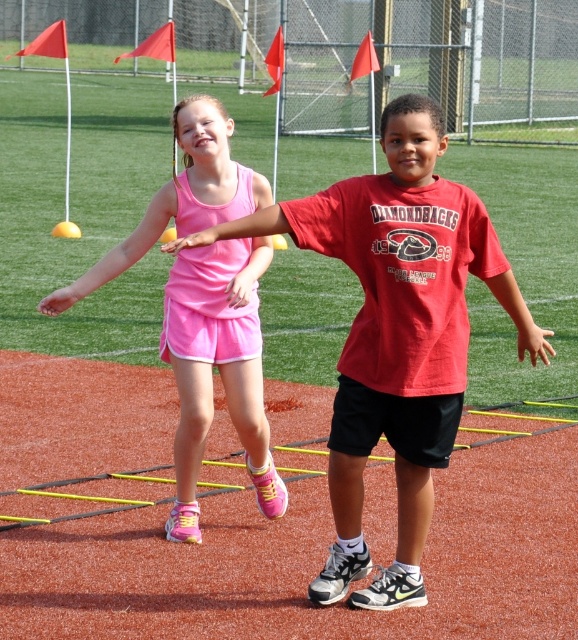
You are a photographer trying to capture both the red matte shirt at center and the matte pink tank top at center in a single frame. Given that the camera can only focus on one object at a time, which object should you focus on to ensure the other remains in the background?

You should focus on the red matte shirt at center because it is larger in size than the matte pink tank top at center, so focusing on the larger object will keep the smaller one in the background.

You are a photographer trying to capture a balanced composition. You have two subjects in the frame, the red matte shirt at center and the matte pink tank top at center. Based on their heights, which subject should you position lower in the frame to achieve visual balance?

The red matte shirt at center is taller than the matte pink tank top at center, so to achieve visual balance, you should position the taller red matte shirt at center lower in the frame and the shorter matte pink tank top at center higher up.